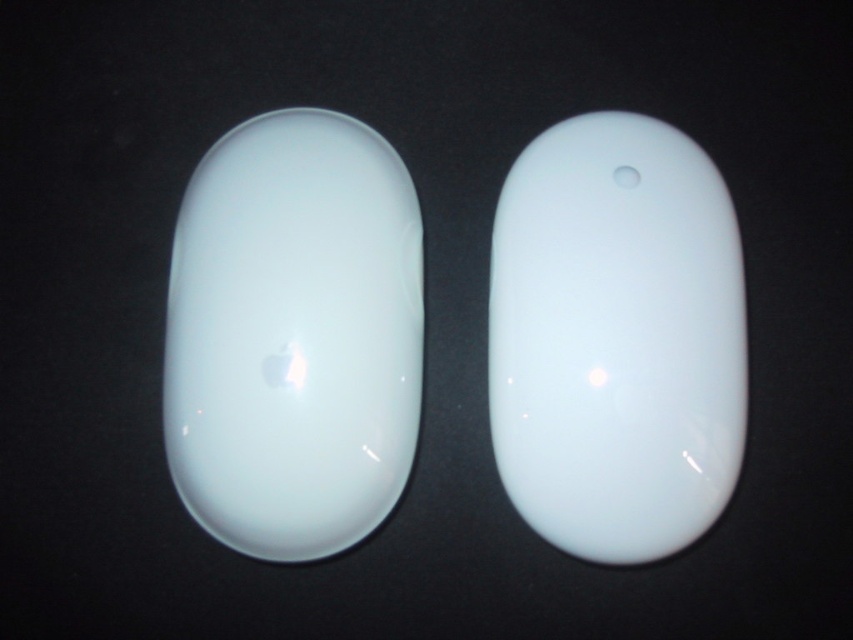
Who is positioned more to the left, glossy white mouse at left or glossy white mouse at center?

glossy white mouse at left

Is glossy white mouse at left bigger than glossy white mouse at center?

No.

Who is more distant from viewer, (288,230) or (585,376)?

The point (288,230) is behind.

The image size is (853, 640). In order to click on glossy white mouse at left in this screenshot , I will do `click(293, 336)`.